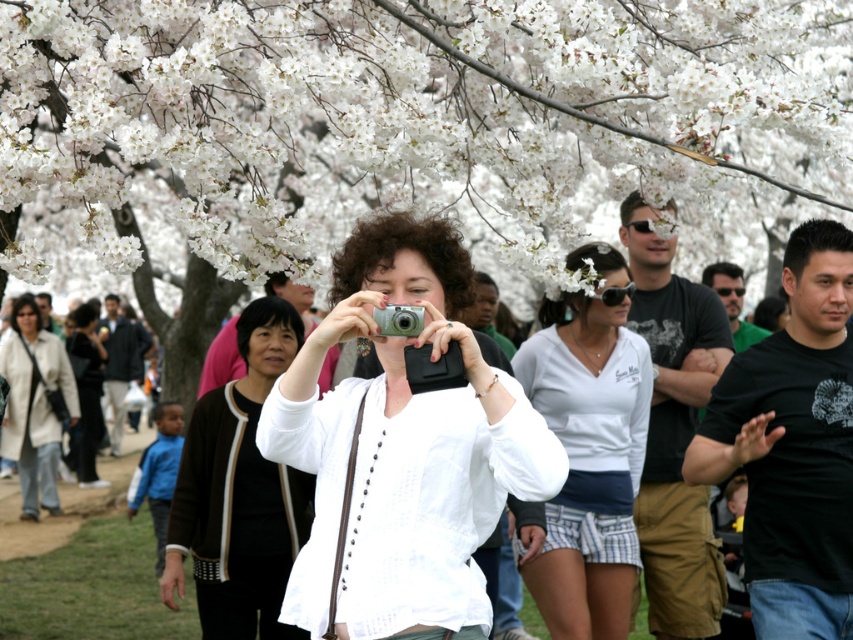
Question: Observing the image, what is the correct spatial positioning of white blossoms at center in reference to white matte jacket at center?

Choices:
 (A) right
 (B) left

Answer: (A)

Question: Can you confirm if white matte jacket at center is wider than matte black jacket at center?

Choices:
 (A) yes
 (B) no

Answer: (B)

Question: Does white cotton shirt at center have a smaller size compared to matte black jacket at center?

Choices:
 (A) no
 (B) yes

Answer: (B)

Question: Among these points, which one is nearest to the camera?

Choices:
 (A) (242, 586)
 (B) (416, 220)

Answer: (B)

Question: Considering the real-world distances, which object is closest to the black matte shirt at center?

Choices:
 (A) white leather jacket at lower left
 (B) matte black sunglasses at upper right
 (C) white matte jacket at center

Answer: (B)

Question: Considering the real-world distances, which object is closest to the black matte shirt at center?

Choices:
 (A) white matte shirt at center
 (B) white cotton shirt at center

Answer: (B)